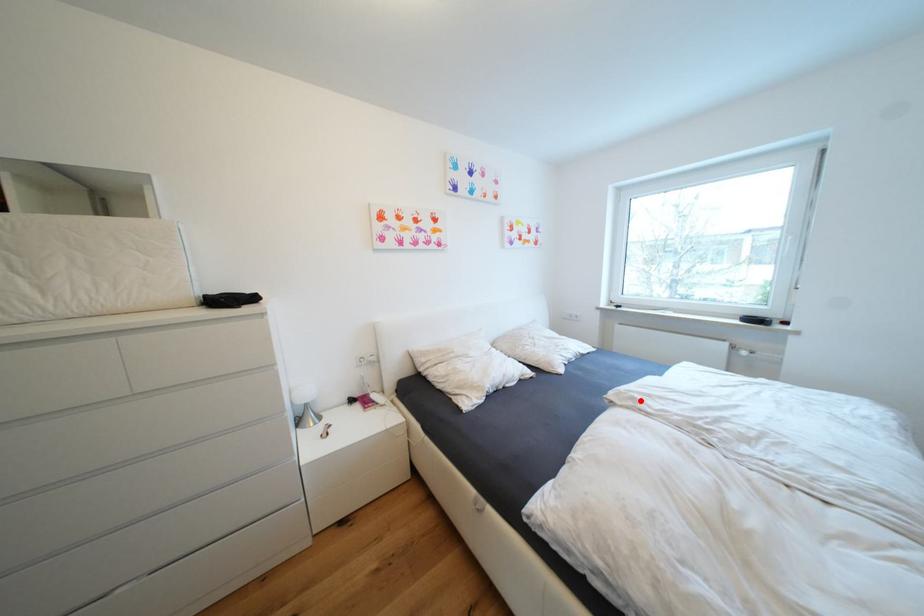
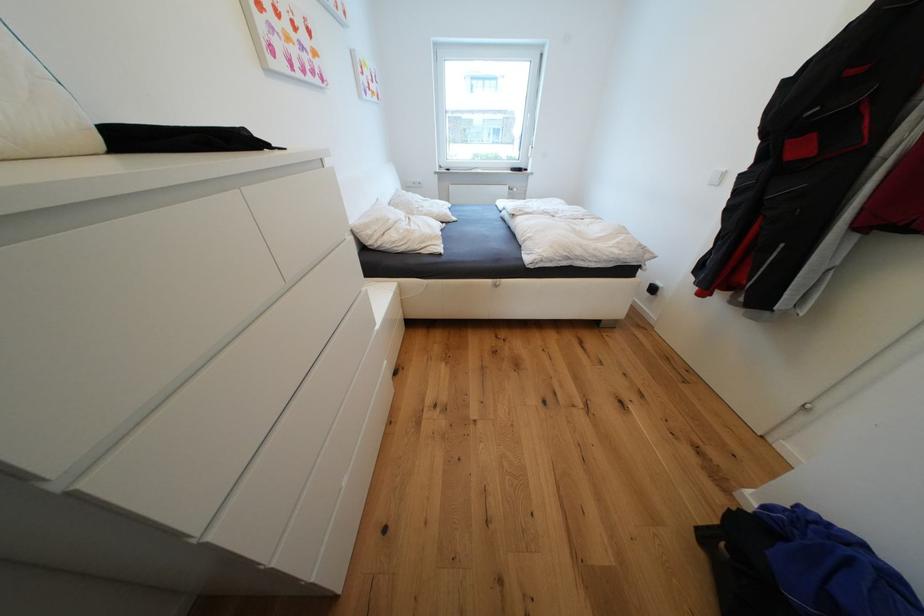
Find the pixel in the second image that matches the highlighted location in the first image.

(528, 212)